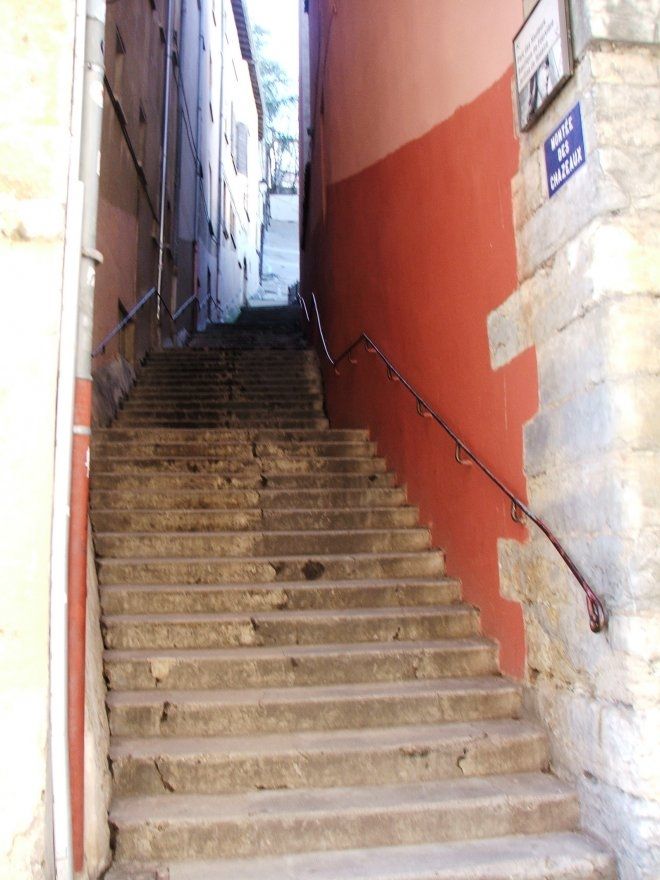
Image resolution: width=660 pixels, height=880 pixels. Find the location of `brackets on wall holding rail`. brackets on wall holding rail is located at coordinates (596, 624), (517, 514), (459, 453), (426, 409), (393, 369), (374, 347), (354, 358), (337, 368), (102, 347).